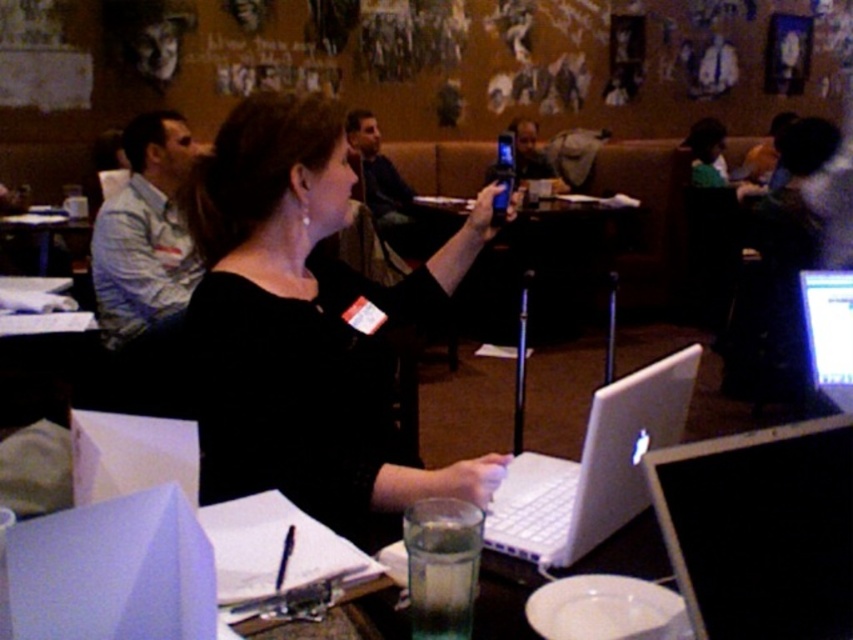
Based on the photo, which is more to the right, white shirt at left or matte black phone at center?

matte black phone at center

Which is above, white shirt at left or matte black phone at center?

Positioned higher is matte black phone at center.

Where is `white shirt at left`? Image resolution: width=853 pixels, height=640 pixels. white shirt at left is located at coordinates (144, 232).

You are a GUI agent. You are given a task and a screenshot of the screen. Output one action in this format:
    pyautogui.click(x=<x>, y=<y>)
    Task: Click on the white shirt at left
    The height and width of the screenshot is (640, 853).
    Given the screenshot: What is the action you would take?
    pyautogui.click(x=144, y=232)

Is white matte laptop at center taller than white shirt at left?

In fact, white matte laptop at center may be shorter than white shirt at left.

Where is `white matte laptop at center`? The width and height of the screenshot is (853, 640). white matte laptop at center is located at coordinates (593, 468).

Where is `white matte laptop at center`? The width and height of the screenshot is (853, 640). white matte laptop at center is located at coordinates (593, 468).

Is point (234, 182) closer to camera compared to point (821, 276)?

Yes, point (234, 182) is in front of point (821, 276).

Measure the distance between point (445, 248) and camera.

They are 5.48 feet apart.

The height and width of the screenshot is (640, 853). Identify the location of black matte shirt at center. (305, 324).